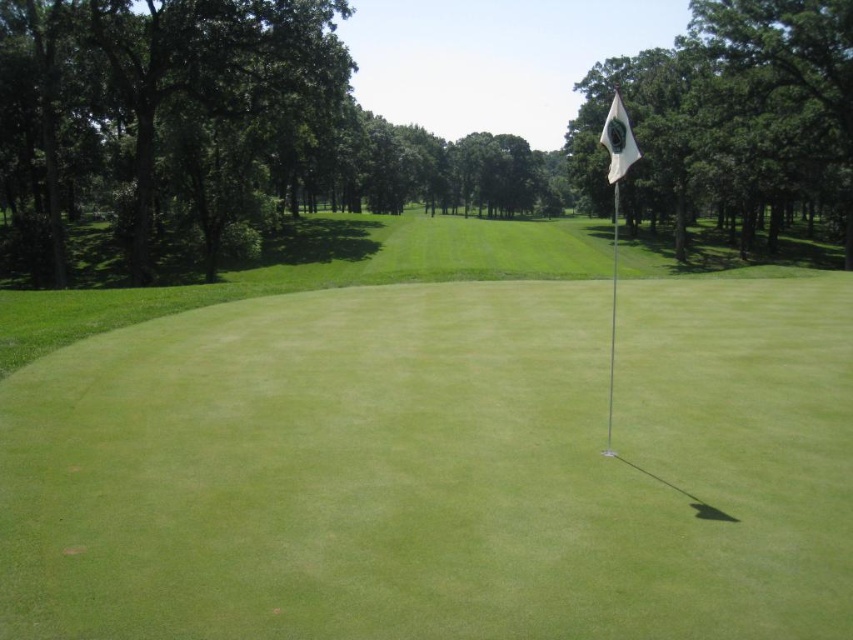
Question: Is green grass flag at center thinner than green leafy tree at upper right?

Choices:
 (A) no
 (B) yes

Answer: (B)

Question: Which point appears farthest from the camera in this image?

Choices:
 (A) (612, 214)
 (B) (248, 84)

Answer: (A)

Question: Is green grass flag at center thinner than white fabric flag at upper right?

Choices:
 (A) yes
 (B) no

Answer: (B)

Question: Which point appears farthest from the camera in this image?

Choices:
 (A) (608, 397)
 (B) (111, 83)
 (C) (827, 612)
 (D) (660, 58)

Answer: (D)

Question: Observing the image, what is the correct spatial positioning of green leafy tree at left in reference to white fabric flag at upper right?

Choices:
 (A) above
 (B) below

Answer: (B)

Question: Which point is farther to the camera?

Choices:
 (A) green leafy tree at left
 (B) white flag at center

Answer: (A)